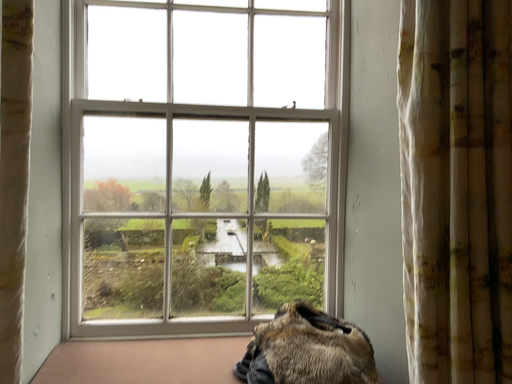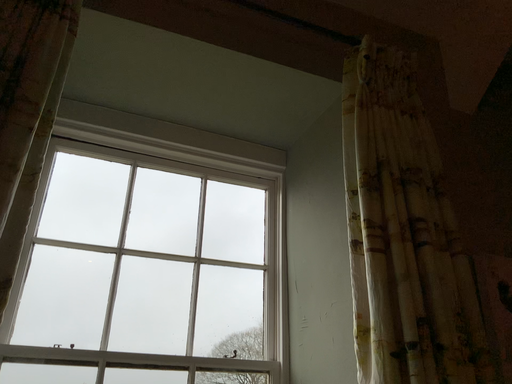
Question: Which way did the camera rotate in the video?

Choices:
 (A) rotated upward
 (B) rotated downward

Answer: (A)